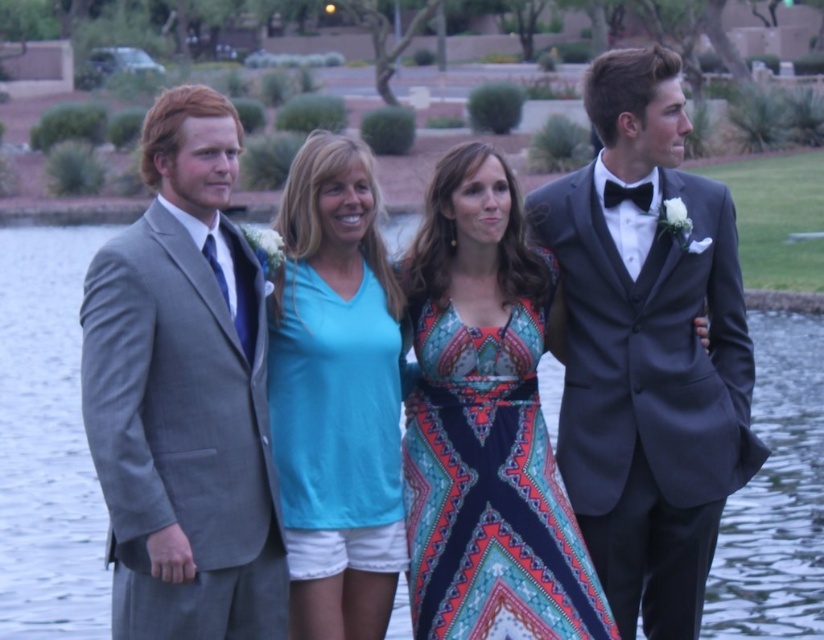
You are standing at the point labeled as point (696, 228) and want to see the entire group of four people clearly. Considering the distance between you and the viewer, can you estimate if you are close enough to see their facial features?

The point (696, 228) is 19.06 meters away from the viewer. At this distance, it may be challenging to see facial features clearly without assistance like binoculars or a zoom lens.

You are taking a photo of the group and want to focus on the two points in the image. Which point, point (722, 298) or point (237, 460), is closer to the camera?

Point (237, 460) is closer to the camera because it is less further than point (722, 298).

Looking at this image, you are a photographer at an event and need to adjust the lighting so that both the shiny black suit at right and the gray wool suit at left are equally visible. Given their positions, which suit might require more light adjustment and why?

The shiny black suit at right might require more light adjustment because it is positioned over the gray wool suit at left, meaning it may be in a different lighting zone or shadow area that needs balancing.